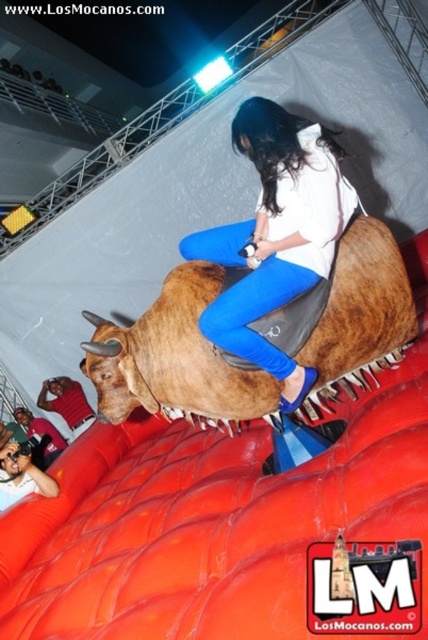
Who is lower down, brown leather bull at center or brushed metal shirt at lower left?

Positioned lower is brushed metal shirt at lower left.

Does brown leather bull at center appear on the right side of brushed metal shirt at lower left?

Yes, brown leather bull at center is to the right of brushed metal shirt at lower left.

Is point (308, 413) positioned after point (73, 428)?

No, it is not.

The image size is (428, 640). Identify the location of brown leather bull at center. (175, 358).

Who is taller, smooth skin face at lower left or brushed metal shirt at lower left?

With more height is brushed metal shirt at lower left.

Does smooth skin face at lower left appear on the left side of brushed metal shirt at lower left?

No, smooth skin face at lower left is not to the left of brushed metal shirt at lower left.

In order to click on smooth skin face at lower left in this screenshot , I will do `click(21, 476)`.

Does point (228, 324) lie in front of point (44, 397)?

Yes, point (228, 324) is in front of point (44, 397).

Between matte white shirt at center and brushed metal shirt at lower left, which one is positioned higher?

matte white shirt at center

Between point (315, 150) and point (59, 406), which one is positioned behind?

The point (59, 406) is behind.

This screenshot has width=428, height=640. What are the coordinates of `matte white shirt at center` in the screenshot? It's located at (276, 236).